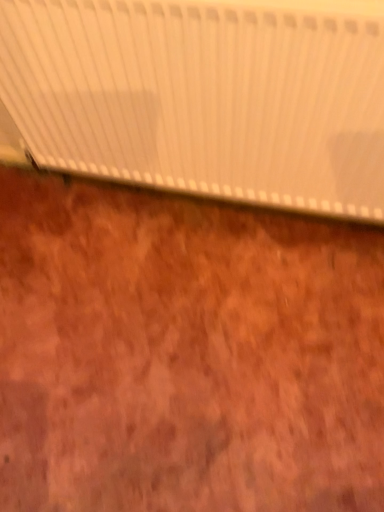
Question: From the image's perspective, relative to brown wood plywood at center, is white matte radiator at upper center above or below?

Choices:
 (A) above
 (B) below

Answer: (A)

Question: From a real-world perspective, relative to brown wood plywood at center, is white matte radiator at upper center vertically above or below?

Choices:
 (A) below
 (B) above

Answer: (B)

Question: Considering their positions, is white matte radiator at upper center located in front of or behind brown wood plywood at center?

Choices:
 (A) behind
 (B) front

Answer: (B)

Question: From the image's perspective, is brown wood plywood at center positioned above or below white matte radiator at upper center?

Choices:
 (A) below
 (B) above

Answer: (A)

Question: Considering the relative positions of brown wood plywood at center and white matte radiator at upper center in the image provided, is brown wood plywood at center to the left or to the right of white matte radiator at upper center?

Choices:
 (A) left
 (B) right

Answer: (A)

Question: Is brown wood plywood at center inside the boundaries of white matte radiator at upper center, or outside?

Choices:
 (A) inside
 (B) outside

Answer: (B)

Question: Considering the positions of point (240, 379) and point (223, 30), is point (240, 379) closer or farther from the camera than point (223, 30)?

Choices:
 (A) closer
 (B) farther

Answer: (B)